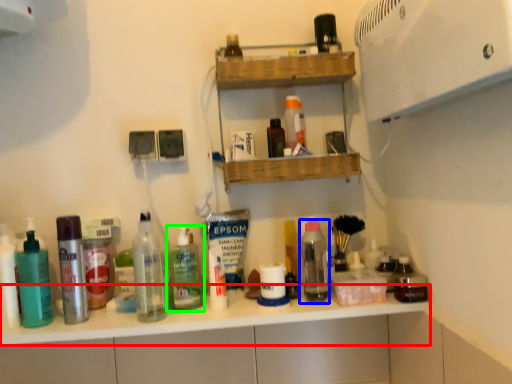
Question: Considering the real-world distances, which object is farthest from counter top (highlighted by a red box)? bottle (highlighted by a blue box) or bottle (highlighted by a green box)?

Choices:
 (A) bottle
 (B) bottle

Answer: (A)